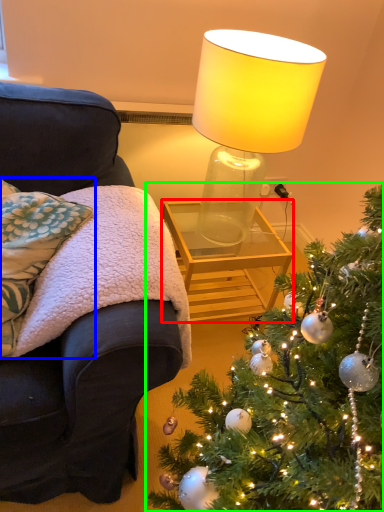
Question: Which is nearer to the table (highlighted by a red box)? pillow (highlighted by a blue box) or christmas tree (highlighted by a green box).

Choices:
 (A) pillow
 (B) christmas tree

Answer: (A)